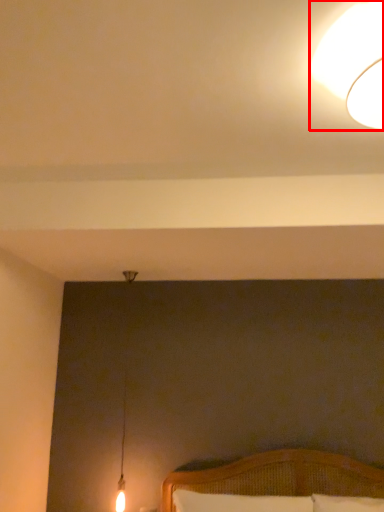
Question: In this image, where is lamp (annotated by the red box) located relative to pillow?

Choices:
 (A) left
 (B) right

Answer: (B)